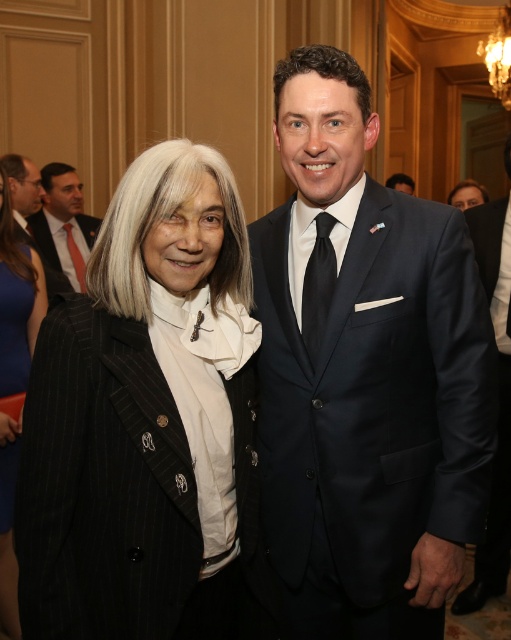
Question: Which point appears farthest from the camera in this image?

Choices:
 (A) (87, 244)
 (B) (10, 211)
 (C) (509, 259)

Answer: (A)

Question: Is black pinstripe suit at left below white silk scarf at upper left?

Choices:
 (A) no
 (B) yes

Answer: (A)

Question: Does shiny dark suit at center have a lesser width compared to matte black suit at upper left?

Choices:
 (A) yes
 (B) no

Answer: (B)

Question: Which of the following is the closest to the observer?

Choices:
 (A) (315, 333)
 (B) (184, 253)
 (C) (496, 268)
 (D) (464, 384)

Answer: (B)

Question: Does black satin tie at center come behind orange silk tie at left?

Choices:
 (A) no
 (B) yes

Answer: (A)

Question: Which of the following is the farthest from the observer?

Choices:
 (A) shiny dark suit at center
 (B) matte black suit at upper left
 (C) black satin tie at center
 (D) dark blue suit at center

Answer: (B)